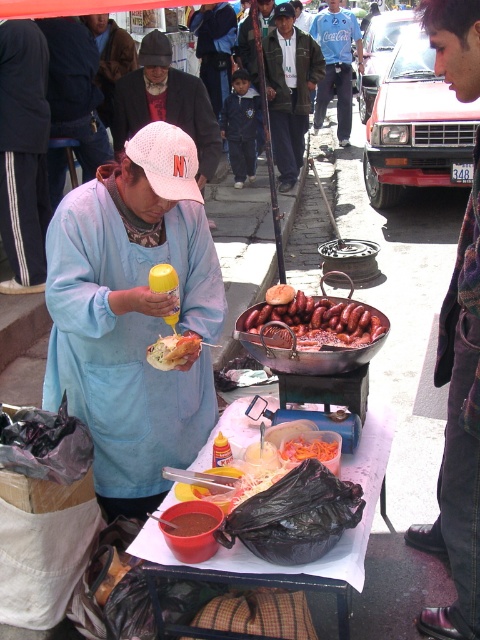
You are a customer at the food stall and want to know which of the two points, point (368, 426) or point (286, 44), is closer to you. Based on the scene, can you determine this?

Point (368, 426) is closer to the camera than point (286, 44), so it is closer to you.

You are a customer standing in front of the food vendor. You want to place your phone on the white paper table at center so you can see both the dark green jacket at center and the table clearly. Is this possible?

The white paper table at center is below dark green jacket at center, so placing your phone on the table would allow you to see both the table and the jacket as the jacket is above the table.